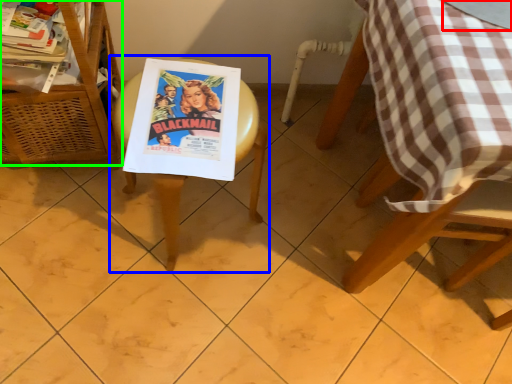
Question: Which object is the farthest from glass table (highlighted by a red box)? Choose among these: picnic table (highlighted by a blue box) or furniture (highlighted by a green box).

Choices:
 (A) picnic table
 (B) furniture

Answer: (B)